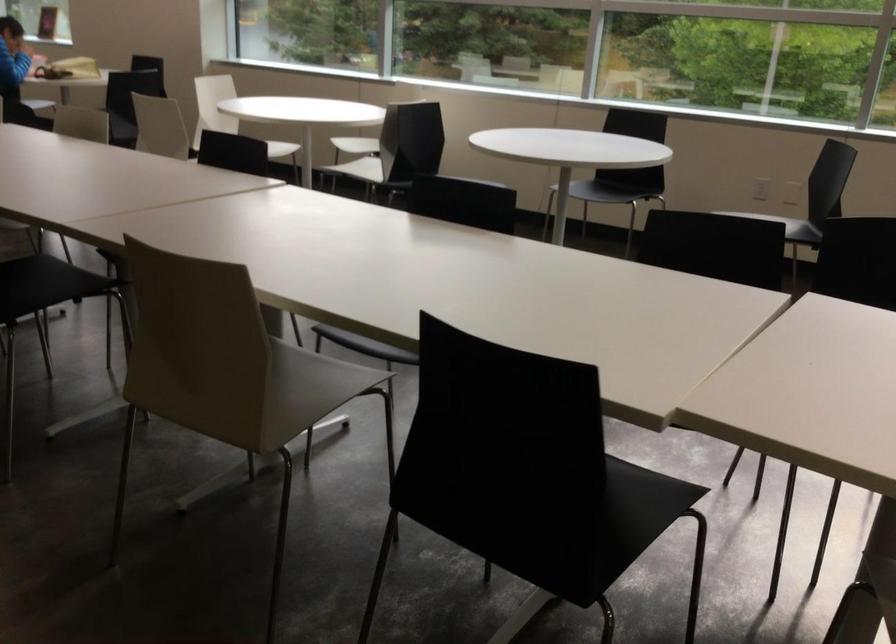
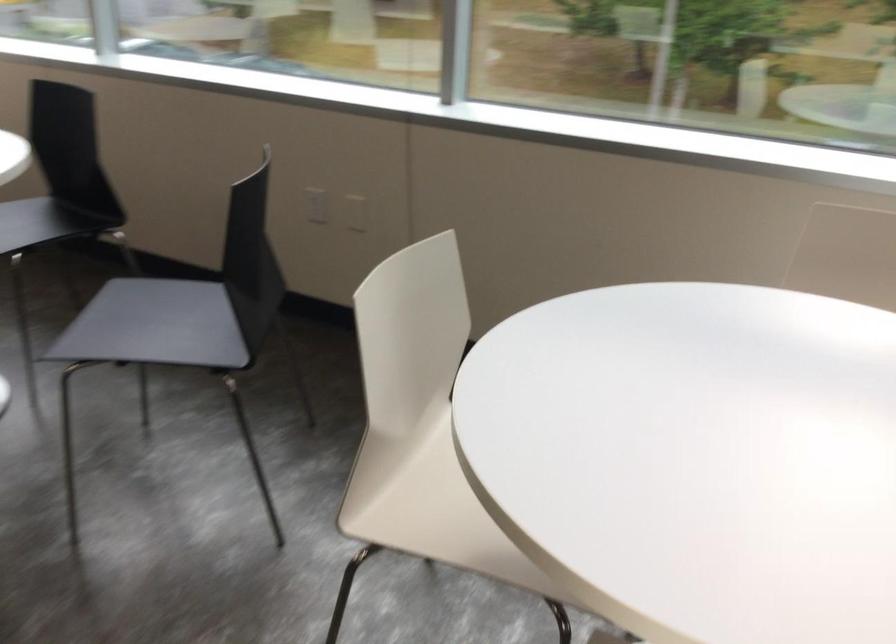
Which direction would the cameraman need to move to produce the second image?

The cameraman moved toward right, forward.